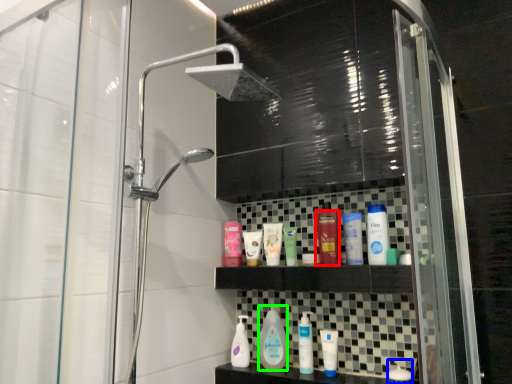
Question: Based on their relative distances, which object is farther from toiletry (highlighted by a red box)? Choose from toiletry (highlighted by a blue box) and cleaning product (highlighted by a green box).

Choices:
 (A) toiletry
 (B) cleaning product

Answer: (A)